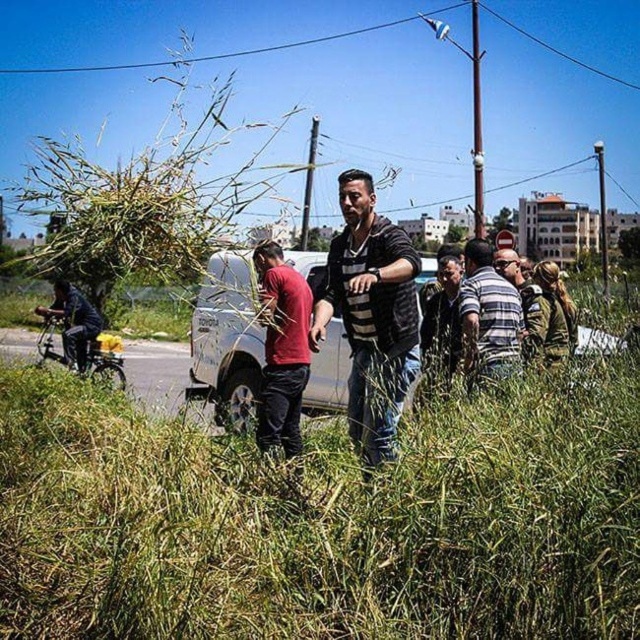
You are a delivery person who needs to place a package between the dark gray striped shirt at center and the dark gray fabric bicycle at left. The package requires a space of 20 feet. Is there enough space between them?

The distance between the dark gray striped shirt at center and the dark gray fabric bicycle at left is 23.21 feet, which is more than enough to accommodate the 20 feet required for the package.

What object is located at the coordinate point [227,340] in the image?

The white matte van at center is located at the coordinate point [227,340].

Looking at this image, you are a delivery driver who needs to load a new bicycle onto the roof of the white matte van at center. The dark gray fabric bicycle at left is currently blocking the van. Can you easily access the van to load the bicycle?

The white matte van at center is located below the dark gray fabric bicycle at left, meaning the bicycle is positioned higher up relative to the van. Since the van is lower, you can likely access it by moving around or past the bicycle to load the new bicycle onto the roof.